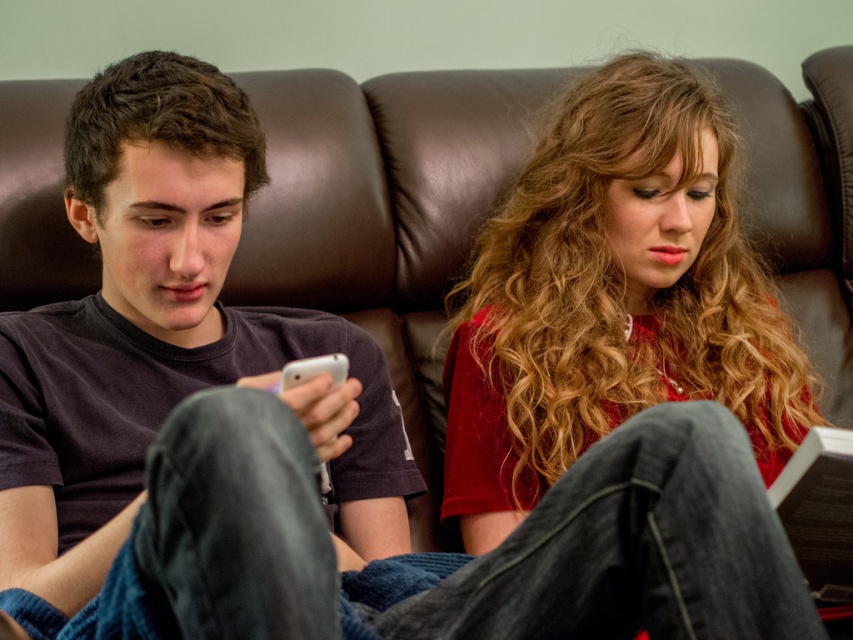
Question: Does matte black phone at left appear under matte red shirt at center?

Choices:
 (A) yes
 (B) no

Answer: (B)

Question: Does matte black phone at left have a smaller size compared to matte red shirt at center?

Choices:
 (A) no
 (B) yes

Answer: (B)

Question: Which of these objects is positioned farthest from the matte black phone at left?

Choices:
 (A) white glossy smartphone at center
 (B) matte red shirt at center

Answer: (B)

Question: Which point is farther from the camera taking this photo?

Choices:
 (A) (311, 365)
 (B) (785, 381)
 (C) (33, 406)

Answer: (B)

Question: From the image, what is the correct spatial relationship of matte red shirt at center in relation to white glossy smartphone at center?

Choices:
 (A) left
 (B) right

Answer: (B)

Question: Which point is closer to the camera?

Choices:
 (A) matte black phone at left
 (B) white glossy smartphone at center
 (C) matte red shirt at center

Answer: (A)